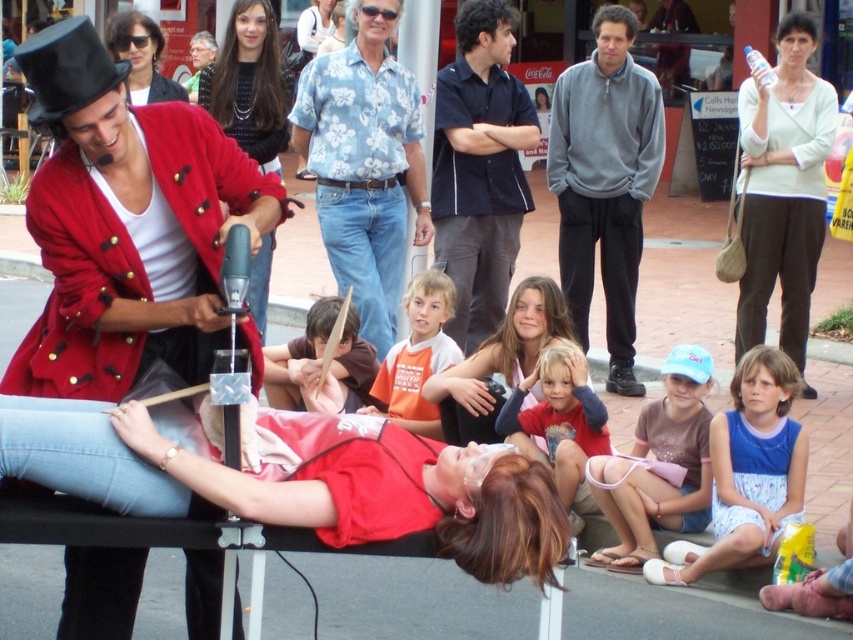
You are a photographer at the scene and want to capture a photo of the red cotton shirt at lower center and the brown fabric shirt at center. According to their positions, which shirt should be placed on the right side of the frame to include both in the photo?

The red cotton shirt at lower center is positioned on the right side of brown fabric shirt at center, so to include both in the photo, the red cotton shirt at lower center should be placed on the right side of the frame.

Based on the photo, you are a photographer trying to capture the street performance. You notice the light beige sweater at upper right and the matte black sunglasses at upper left in your frame. Which object should you focus on first if you want to photograph the one closer to the bottom of the image?

The light beige sweater at upper right is below the matte black sunglasses at upper left, so you should focus on the light beige sweater at upper right first since it is closer to the bottom of the image.